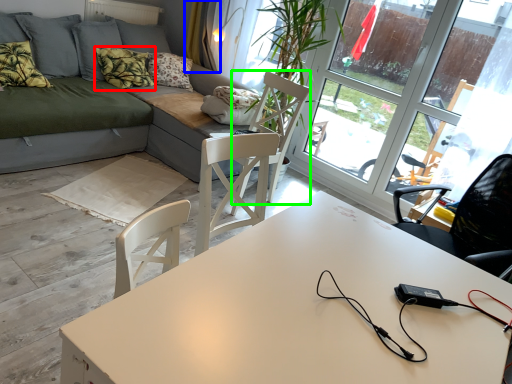
Question: Which object is the closest to the pillow (highlighted by a red box)? Choose among these: curtain (highlighted by a blue box) or swivel chair (highlighted by a green box).

Choices:
 (A) curtain
 (B) swivel chair

Answer: (A)